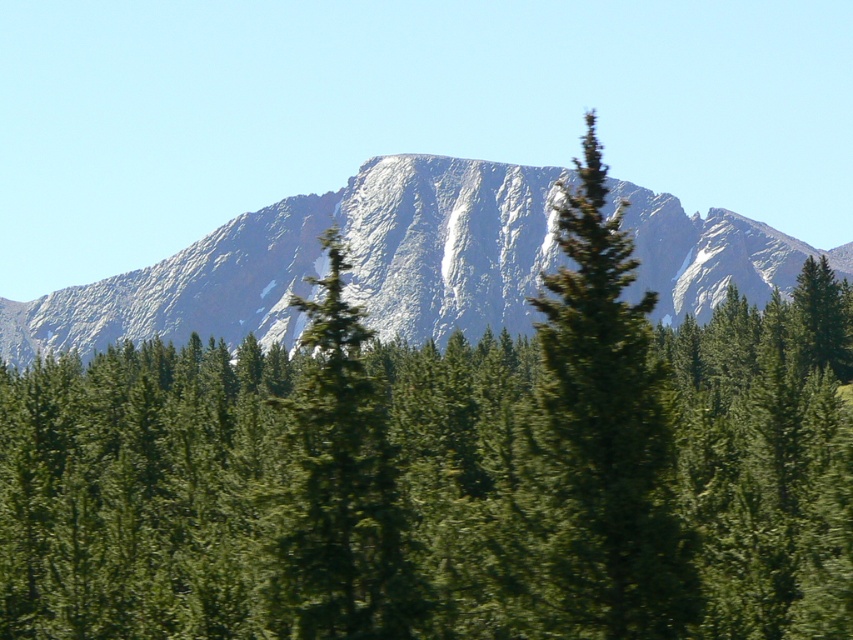
You are standing in the dense forest of coniferous trees in the foreground of the image. You notice a specific point marked at coordinates point (599, 442). What object is located at that point?

The point (599, 442) marks a green textured tree at center.

You are standing in the dense forest of coniferous trees in the foreground of the image. You notice two points marked in the scene. Which point, point [618,577] or point [567,173], is closer to you?

Point [618,577] is closer to the viewer than point [567,173].